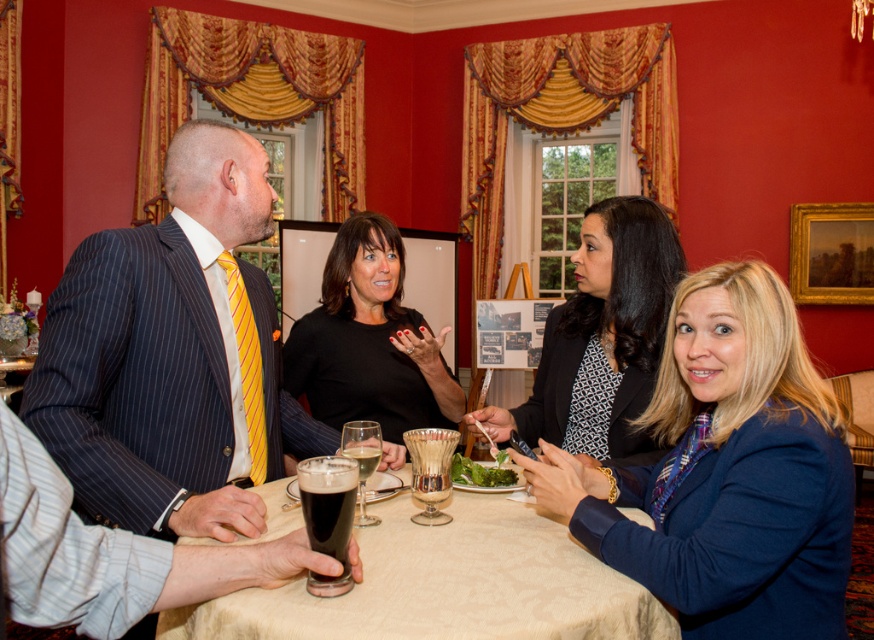
Question: Is black matte shirt at center bigger than dark glass beer at center?

Choices:
 (A) yes
 (B) no

Answer: (A)

Question: Does green leafy salad at center have a smaller size compared to translucent glass at center?

Choices:
 (A) yes
 (B) no

Answer: (B)

Question: Which point is farther to the camera?

Choices:
 (A) (760, 520)
 (B) (461, 456)

Answer: (B)

Question: Which point appears closest to the camera in this image?

Choices:
 (A) (420, 602)
 (B) (359, 474)
 (C) (304, 492)

Answer: (A)

Question: Can you confirm if striped wool suit at center is positioned to the right of translucent glass at center?

Choices:
 (A) yes
 (B) no

Answer: (B)

Question: Among these objects, which one is nearest to the camera?

Choices:
 (A) dark glass beer at center
 (B) matte black blazer at center

Answer: (A)